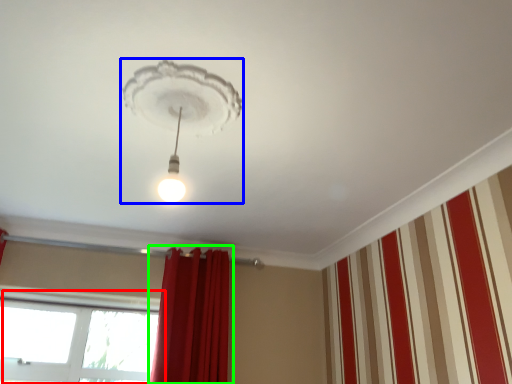
Question: Based on their relative distances, which object is nearer to window (highlighted by a red box)? Choose from lamp (highlighted by a blue box) and curtain (highlighted by a green box).

Choices:
 (A) lamp
 (B) curtain

Answer: (B)